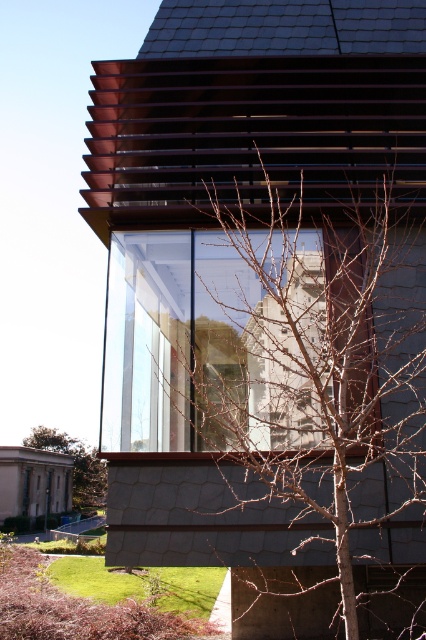
Does bare branches at center appear under transparent glass window at center?

Indeed, bare branches at center is positioned under transparent glass window at center.

Is bare branches at center smaller than transparent glass window at center?

No.

Does point (287, 401) come in front of point (247, 342)?

Yes, it is.

At what (x,y) coordinates should I click in order to perform the action: click on bare branches at center. Please return your answer as a coordinate pair (x, y). The width and height of the screenshot is (426, 640). Looking at the image, I should click on (313, 365).

Between transparent glass window at center and brown leafless tree at lower left, which one has less height?

Standing shorter between the two is transparent glass window at center.

Does transparent glass window at center have a lesser height compared to brown leafless tree at lower left?

Indeed, transparent glass window at center has a lesser height compared to brown leafless tree at lower left.

At what (x,y) coordinates should I click in order to perform the action: click on transparent glass window at center. Please return your answer as a coordinate pair (x, y). Looking at the image, I should click on (221, 340).

Where is `transparent glass window at center`? The height and width of the screenshot is (640, 426). transparent glass window at center is located at coordinates (221, 340).

Is point (394, 445) behind point (77, 440)?

That is False.

Can you confirm if bare branches at center is positioned below brown leafless tree at lower left?

No, bare branches at center is not below brown leafless tree at lower left.

Is point (368, 337) closer to viewer compared to point (100, 464)?

Yes, it is.

Find the location of `bare branches at center`. bare branches at center is located at coordinates (313, 365).